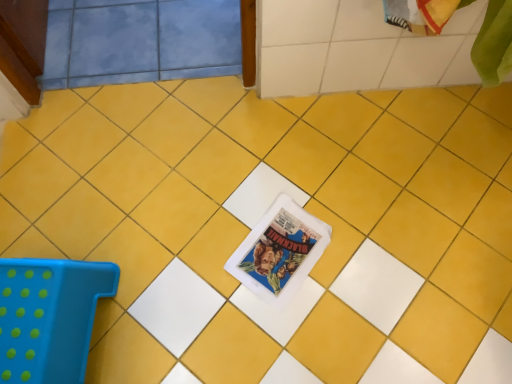
Locate an element on the screen. The height and width of the screenshot is (384, 512). vacant space to the right of matte plastic comic book at center is located at coordinates (358, 254).